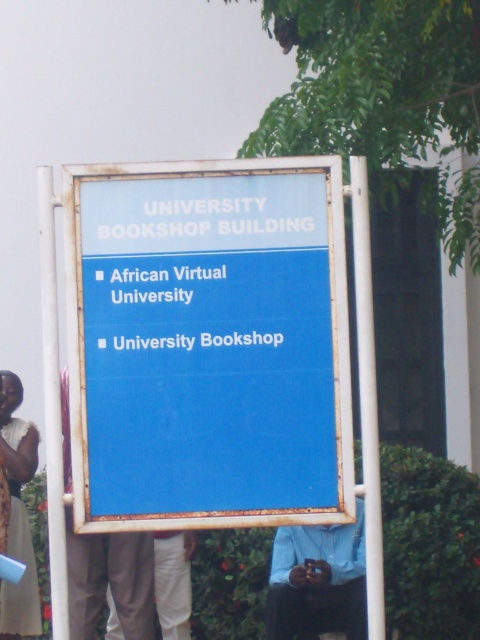
Between blue matte sign at center and blue shirt at center, which one appears on the left side from the viewer's perspective?

blue matte sign at center

The height and width of the screenshot is (640, 480). Find the location of `blue matte sign at center`. blue matte sign at center is located at coordinates pyautogui.click(x=207, y=344).

Image resolution: width=480 pixels, height=640 pixels. In order to click on blue matte sign at center in this screenshot , I will do `click(207, 344)`.

Describe the element at coordinates (207, 344) in the screenshot. I see `blue matte sign at center` at that location.

Identify the location of blue matte sign at center. (207, 344).

Based on the photo, does white lace dress at lower left lie behind light brown pants at lower left?

Yes, it is.

Where is `white lace dress at lower left`? white lace dress at lower left is located at coordinates (17, 513).

Is point (7, 387) closer to camera compared to point (156, 604)?

No, (7, 387) is further to viewer.

In order to click on white lace dress at lower left in this screenshot , I will do `click(17, 513)`.